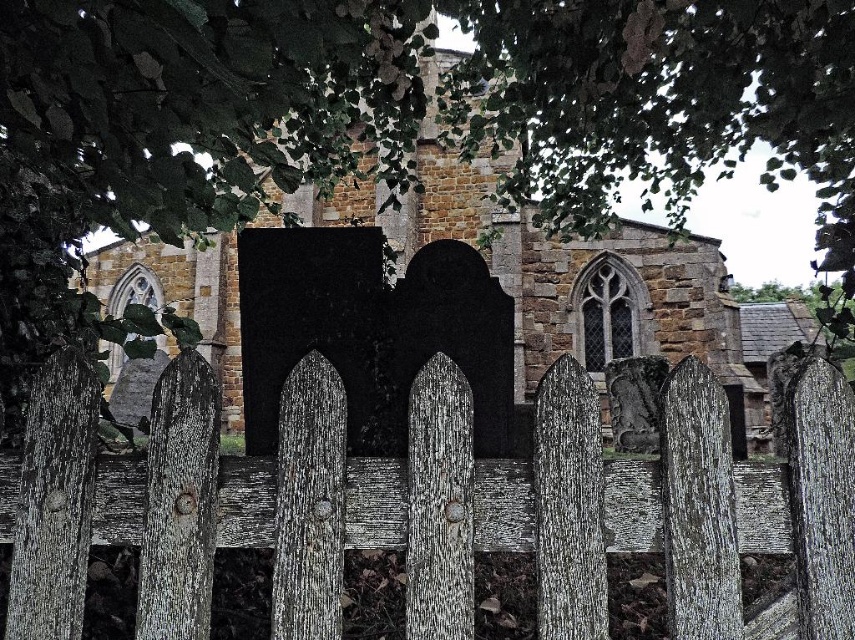
Question: Is weathered wood fence at center positioned before stone church at center?

Choices:
 (A) no
 (B) yes

Answer: (B)

Question: Does weathered wood fence at center have a greater width compared to stone church at center?

Choices:
 (A) yes
 (B) no

Answer: (B)

Question: Which point appears farthest from the camera in this image?

Choices:
 (A) (517, 278)
 (B) (329, 477)

Answer: (A)

Question: Can you confirm if weathered wood fence at center is thinner than stone church at center?

Choices:
 (A) no
 (B) yes

Answer: (B)